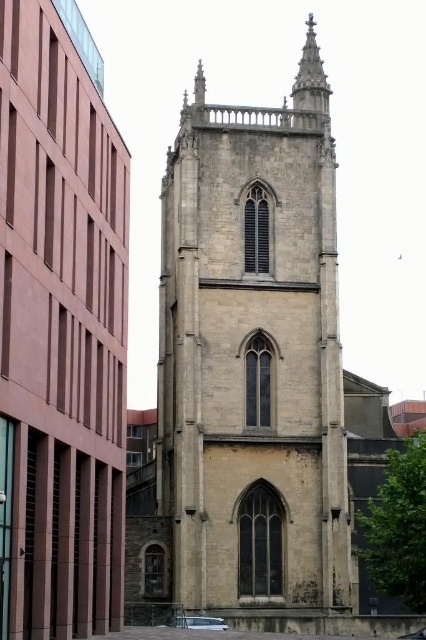
Question: Can you confirm if beige stone church at center is positioned below stone spire at upper center?

Choices:
 (A) no
 (B) yes

Answer: (B)

Question: Can you confirm if beige stone tower at center is thinner than stone spire at upper center?

Choices:
 (A) no
 (B) yes

Answer: (A)

Question: Which of the following is the farthest from the observer?

Choices:
 (A) stone spire at upper center
 (B) beige stone church at center

Answer: (A)

Question: Which of these objects is positioned farthest from the stone spire at upper center?

Choices:
 (A) beige stone tower at center
 (B) beige stone church at center

Answer: (B)

Question: Which point appears farthest from the camera in this image?

Choices:
 (A) (173, 323)
 (B) (302, 96)

Answer: (B)

Question: Does beige stone tower at center have a lesser width compared to stone spire at upper center?

Choices:
 (A) no
 (B) yes

Answer: (A)